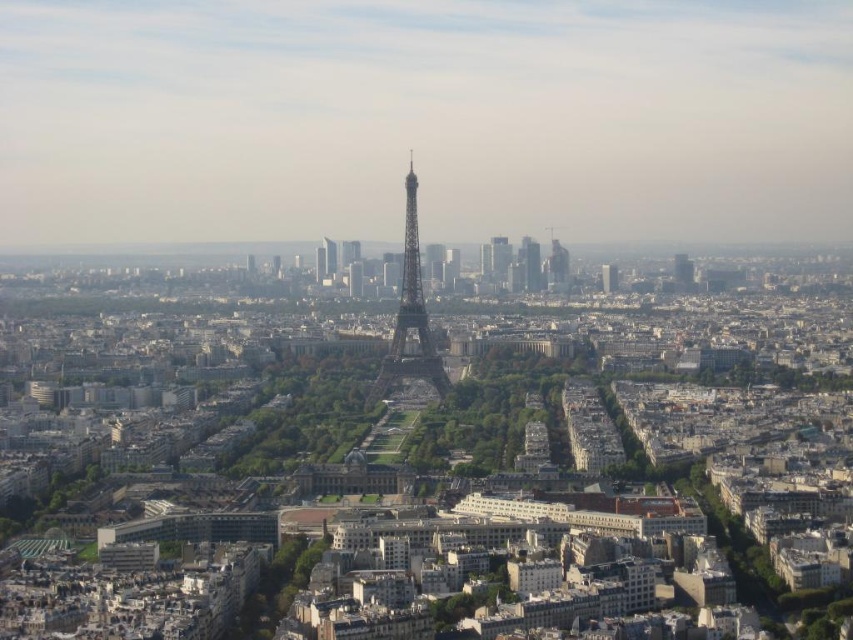
You are a drone operator tasked with capturing a photo of the Eiffel Tower. Your drone is currently hovering at point 0.402, 0.586. Is the glassy reflective skyscraper at center in the way of your shot?

The glassy reflective skyscraper at center is located at point (498,257), which is where your drone is currently hovering. This means the skyscraper is directly in the path of your drone, potentially obstructing the shot of the Eiffel Tower unless adjusted.